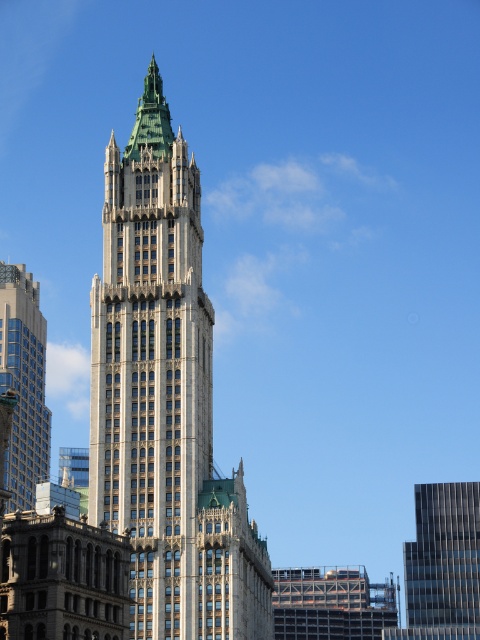
Question: Is white stone tower at center wider than glassy gray skyscraper at right?

Choices:
 (A) yes
 (B) no

Answer: (A)

Question: Is glassy gray skyscraper at right below matte glass skyscraper at left?

Choices:
 (A) yes
 (B) no

Answer: (A)

Question: Can you confirm if white stone tower at center is positioned to the right of matte glass skyscraper at left?

Choices:
 (A) yes
 (B) no

Answer: (A)

Question: Which point appears closest to the camera in this image?

Choices:
 (A) (195, 422)
 (B) (479, 600)
 (C) (0, 392)

Answer: (A)

Question: Which point is closer to the camera?

Choices:
 (A) (195, 570)
 (B) (9, 282)
 (C) (462, 596)

Answer: (A)

Question: Which point is closer to the camera?

Choices:
 (A) (159, 218)
 (B) (427, 509)
 (C) (16, 300)

Answer: (A)